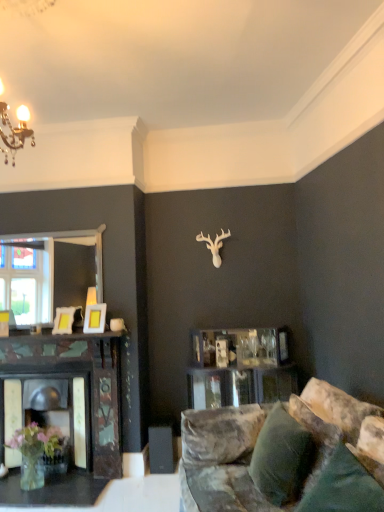
Question: From a real-world perspective, does velvet green pillow at lower right, the second pillow in the front-to-back sequence, sit lower than matte yellow picture frame at center, marked as the first picture frame in a right-to-left arrangement?

Choices:
 (A) no
 (B) yes

Answer: (B)

Question: Is velvet green pillow at lower right, the second pillow in the front-to-back sequence, shorter than matte yellow picture frame at center, marked as the first picture frame in a right-to-left arrangement?

Choices:
 (A) yes
 (B) no

Answer: (B)

Question: Could matte yellow picture frame at center, marked as the first picture frame in a right-to-left arrangement, be considered to be inside velvet green pillow at lower right, placed as the first pillow when sorted from back to front?

Choices:
 (A) yes
 (B) no

Answer: (B)

Question: Is velvet green pillow at lower right, placed as the first pillow when sorted from back to front, aimed at matte yellow picture frame at center, the second picture frame positioned from the left?

Choices:
 (A) yes
 (B) no

Answer: (B)

Question: Is velvet green pillow at lower right, the second pillow in the front-to-back sequence, with matte yellow picture frame at center, marked as the first picture frame in a right-to-left arrangement?

Choices:
 (A) no
 (B) yes

Answer: (A)

Question: Is velvety green pillow at lower right, arranged as the first pillow when viewed from the front, to the left or to the right of clear glass vase at lower left in the image?

Choices:
 (A) right
 (B) left

Answer: (A)

Question: Do you think velvety green pillow at lower right, arranged as the first pillow when viewed from the front, is within clear glass vase at lower left, or outside of it?

Choices:
 (A) outside
 (B) inside

Answer: (A)

Question: Considering the positions of velvety green pillow at lower right, the second pillow from the back, and clear glass vase at lower left in the image, is velvety green pillow at lower right, the second pillow from the back, wider or thinner than clear glass vase at lower left?

Choices:
 (A) thin
 (B) wide

Answer: (A)

Question: Considering their positions, is velvety green pillow at lower right, the second pillow from the back, located in front of or behind clear glass vase at lower left?

Choices:
 (A) behind
 (B) front

Answer: (B)

Question: Is velvet green pillow at lower right, the second pillow in the front-to-back sequence, taller or shorter than velvety green pillow at lower right, arranged as the first pillow when viewed from the front?

Choices:
 (A) tall
 (B) short

Answer: (A)

Question: From the image's perspective, is velvet green pillow at lower right, the second pillow in the front-to-back sequence, positioned above or below velvety green pillow at lower right, arranged as the first pillow when viewed from the front?

Choices:
 (A) above
 (B) below

Answer: (B)

Question: Looking at the image, does velvet green pillow at lower right, the second pillow in the front-to-back sequence, seem bigger or smaller compared to velvety green pillow at lower right, the second pillow from the back?

Choices:
 (A) small
 (B) big

Answer: (B)

Question: Considering the positions of point (291, 465) and point (357, 507), is point (291, 465) closer or farther from the camera than point (357, 507)?

Choices:
 (A) farther
 (B) closer

Answer: (A)

Question: Is velvety green pillow at lower right, arranged as the first pillow when viewed from the front, in front of or behind velvet green pillow at lower right, the second pillow in the front-to-back sequence, in the image?

Choices:
 (A) front
 (B) behind

Answer: (A)

Question: Choose the correct answer: Is velvety green pillow at lower right, the second pillow from the back, inside velvet green pillow at lower right, the second pillow in the front-to-back sequence, or outside it?

Choices:
 (A) inside
 (B) outside

Answer: (B)